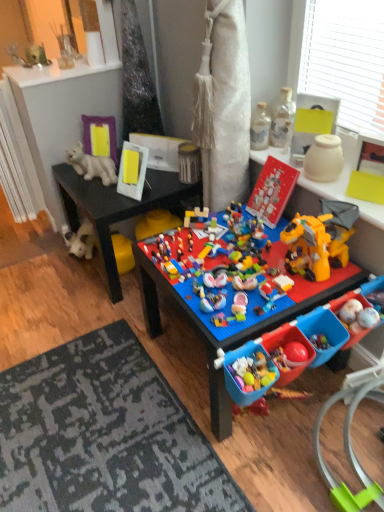
Where is `free point to the left of metallic can at center, which ranks as the 5th toy in right-to-left order`? free point to the left of metallic can at center, which ranks as the 5th toy in right-to-left order is located at coordinates (172, 178).